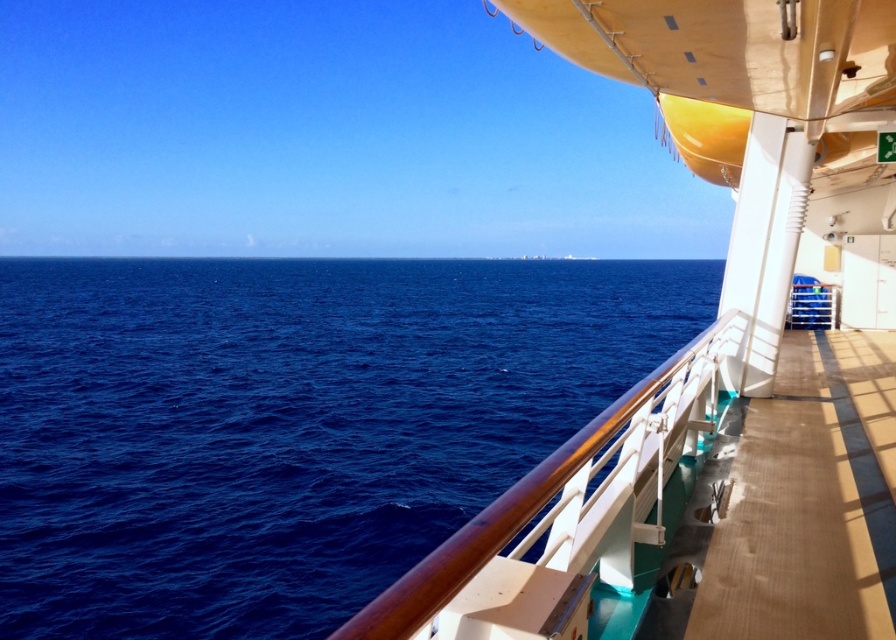
From the picture: You are standing on the deck of the cruise ship and want to move from the brown polished wood at right to the wooden at right. Which object should you approach first?

You should approach the brown polished wood at right first because it is closer to you than the wooden at right, which is further away.

You are standing on the deck of the cruise ship and see the white glossy boat at right and the brown polished wood at right. Which object is taller?

The white glossy boat at right is taller than the brown polished wood at right.